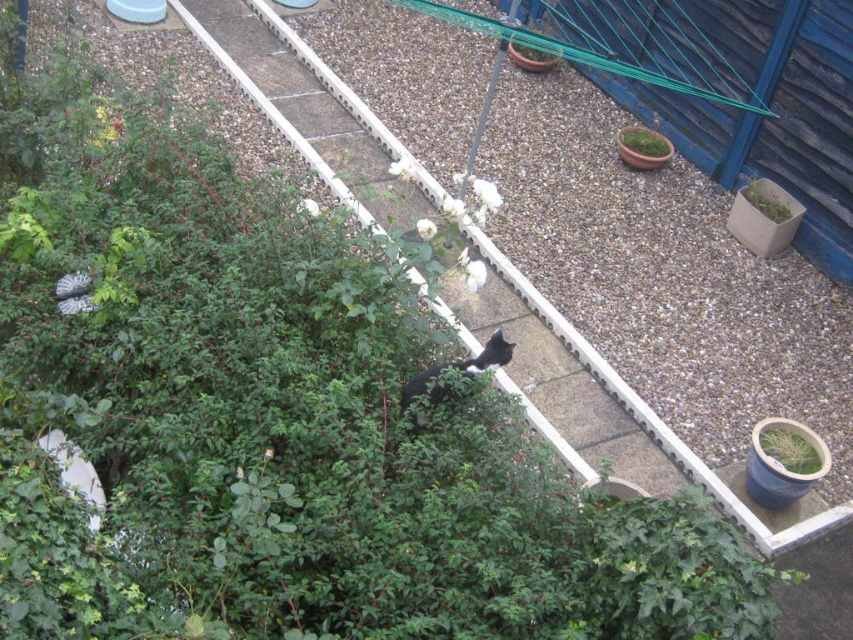
Question: Among these objects, which one is farthest from the camera?

Choices:
 (A) green leafy plant at lower right
 (B) green leafy plant at upper right
 (C) green mossy pot at upper right

Answer: (C)

Question: Which point is closer to the camera taking this photo?

Choices:
 (A) (833, 138)
 (B) (788, 205)
 (C) (643, 148)
 (D) (787, 458)

Answer: (D)

Question: Which point is closer to the camera?

Choices:
 (A) black fur cat at center
 (B) green mossy pot at upper right

Answer: (A)

Question: Is green wire fence at upper right above green leafy plant at upper right?

Choices:
 (A) no
 (B) yes

Answer: (B)

Question: Does green wire fence at upper right have a greater width compared to black fur cat at center?

Choices:
 (A) yes
 (B) no

Answer: (A)

Question: Is black fur cat at center wider than green mossy pot at upper right?

Choices:
 (A) no
 (B) yes

Answer: (B)